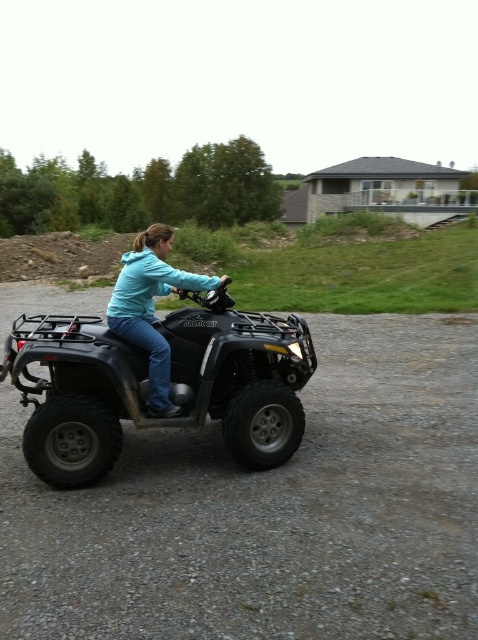
Question: Is matte black atv at center below teal matte jacket at center?

Choices:
 (A) no
 (B) yes

Answer: (B)

Question: Which of the following is the closest to the observer?

Choices:
 (A) (142, 243)
 (B) (455, 616)
 (C) (245, 401)

Answer: (B)

Question: Which object appears farthest from the camera in this image?

Choices:
 (A) teal matte jacket at center
 (B) black rubber dirt track at center

Answer: (B)

Question: Is matte black atv at center closer to camera compared to teal matte jacket at center?

Choices:
 (A) no
 (B) yes

Answer: (B)

Question: Is black rubber dirt track at center to the left of teal matte jacket at center from the viewer's perspective?

Choices:
 (A) yes
 (B) no

Answer: (B)

Question: Which of the following is the farthest from the observer?

Choices:
 (A) matte black atv at center
 (B) teal matte jacket at center

Answer: (B)